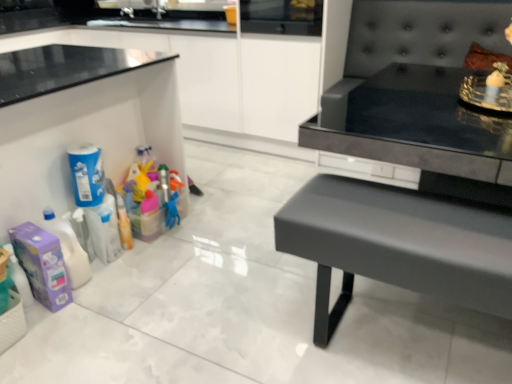
Question: Considering the relative sizes of purple cardboard box at lower left, which is the 1th cleaning product from bottom to top, and blue matte cleaning product at left, which ranks as the 2th cleaning product in bottom-to-top order, in the image provided, is purple cardboard box at lower left, which is the 1th cleaning product from bottom to top, smaller than blue matte cleaning product at left, which ranks as the 2th cleaning product in bottom-to-top order,?

Choices:
 (A) no
 (B) yes

Answer: (A)

Question: Is purple cardboard box at lower left, which is the 1th cleaning product from bottom to top, outside of blue matte cleaning product at left, which appears as the 1th cleaning product when viewed from the top?

Choices:
 (A) no
 (B) yes

Answer: (B)

Question: Is purple cardboard box at lower left, which is the second cleaning product from top to bottom, positioned with its back to blue matte cleaning product at left, which appears as the 1th cleaning product when viewed from the top?

Choices:
 (A) no
 (B) yes

Answer: (A)

Question: Can you confirm if purple cardboard box at lower left, which is the second cleaning product from top to bottom, is wider than blue matte cleaning product at left, which ranks as the 2th cleaning product in bottom-to-top order?

Choices:
 (A) yes
 (B) no

Answer: (A)

Question: Does purple cardboard box at lower left, which is the second cleaning product from top to bottom, have a larger size compared to blue matte cleaning product at left, which appears as the 1th cleaning product when viewed from the top?

Choices:
 (A) yes
 (B) no

Answer: (A)

Question: From a real-world perspective, is purple cardboard box at lower left, which is the 1th cleaning product from bottom to top, above or below matte black bench at right?

Choices:
 (A) below
 (B) above

Answer: (A)

Question: Considering the positions of purple cardboard box at lower left, which is the second cleaning product from top to bottom, and matte black bench at right in the image, is purple cardboard box at lower left, which is the second cleaning product from top to bottom, taller or shorter than matte black bench at right?

Choices:
 (A) tall
 (B) short

Answer: (B)

Question: In the image, is purple cardboard box at lower left, which is the 1th cleaning product from bottom to top, positioned in front of or behind matte black bench at right?

Choices:
 (A) behind
 (B) front

Answer: (A)

Question: Visually, is purple cardboard box at lower left, which is the 1th cleaning product from bottom to top, positioned to the left or to the right of matte black bench at right?

Choices:
 (A) left
 (B) right

Answer: (A)

Question: Is white glossy cabinetry at upper left situated inside white woven basket at lower left or outside?

Choices:
 (A) inside
 (B) outside

Answer: (B)

Question: In terms of size, does white glossy cabinetry at upper left appear bigger or smaller than white woven basket at lower left?

Choices:
 (A) big
 (B) small

Answer: (A)

Question: From the image's perspective, is white glossy cabinetry at upper left located above or below white woven basket at lower left?

Choices:
 (A) below
 (B) above

Answer: (B)

Question: From a real-world perspective, is white glossy cabinetry at upper left above or below white woven basket at lower left?

Choices:
 (A) above
 (B) below

Answer: (A)

Question: From the image's perspective, is white woven basket at lower left positioned above or below matte black bench at right?

Choices:
 (A) above
 (B) below

Answer: (B)

Question: In terms of size, does white woven basket at lower left appear bigger or smaller than matte black bench at right?

Choices:
 (A) small
 (B) big

Answer: (A)